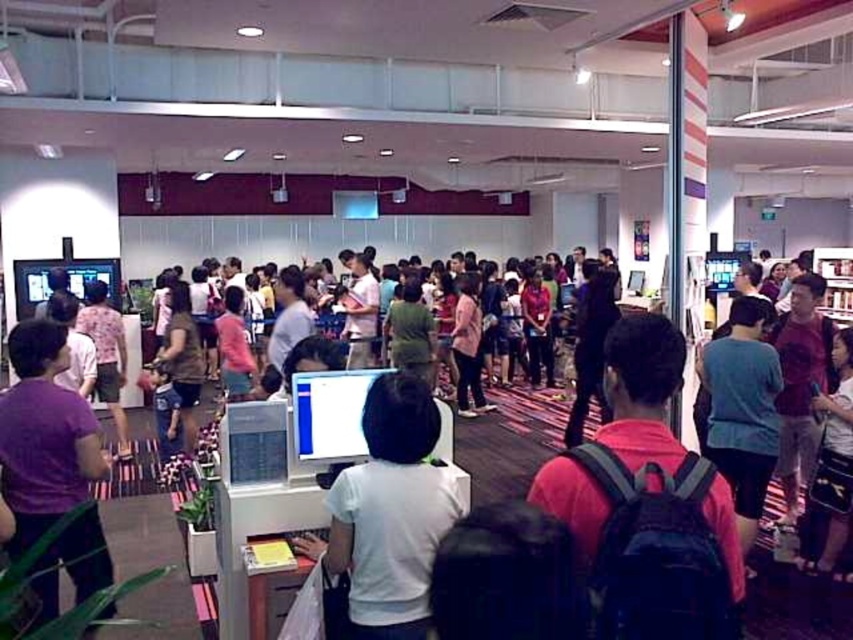
Does white matte computer at center have a greater height compared to purple matte shirt at left?

No.

Does point (434, 500) lie behind point (21, 372)?

No, it is not.

At what (x,y) coordinates should I click in order to perform the action: click on white matte computer at center. Please return your answer as a coordinate pair (x, y). Looking at the image, I should click on click(392, 512).

The image size is (853, 640). In order to click on white matte computer at center in this screenshot , I will do `click(392, 512)`.

Which is more to the left, purple matte shirt at left or white cotton shirt at center?

purple matte shirt at left

Who is more forward, (97, 570) or (839, 332)?

Point (97, 570) is in front.

This screenshot has width=853, height=640. I want to click on purple matte shirt at left, so click(x=44, y=435).

Find the location of `purple matte shirt at left`. purple matte shirt at left is located at coordinates (44, 435).

Is red backpack at center shorter than white cotton shirt at center?

Yes.

Does red backpack at center have a larger size compared to white cotton shirt at center?

Yes, red backpack at center is bigger than white cotton shirt at center.

This screenshot has height=640, width=853. Find the location of `red backpack at center`. red backpack at center is located at coordinates (643, 467).

The width and height of the screenshot is (853, 640). I want to click on red backpack at center, so click(643, 467).